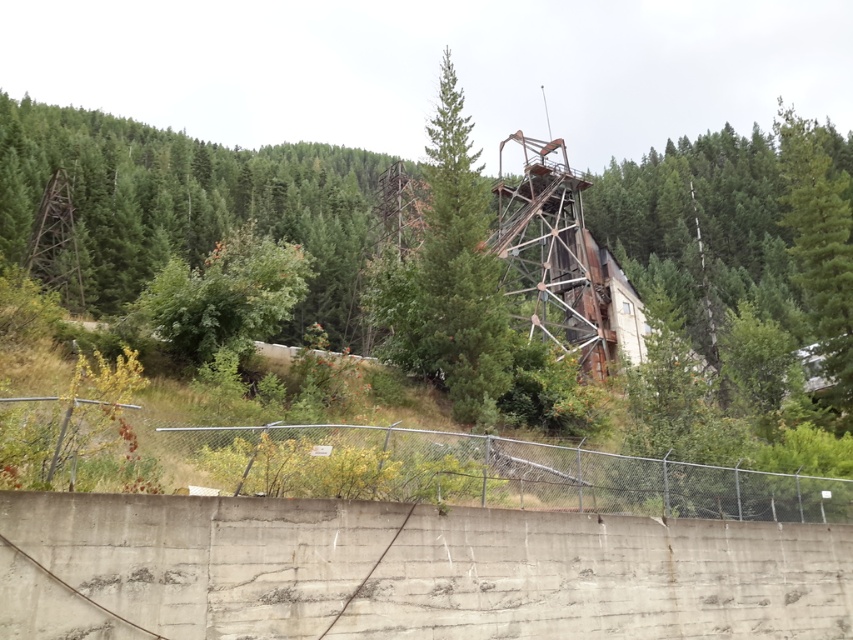
This screenshot has height=640, width=853. Describe the element at coordinates (450, 273) in the screenshot. I see `green matte tree at center` at that location.

Who is more distant from viewer, (466, 234) or (810, 236)?

The point (810, 236) is behind.

The image size is (853, 640). What are the coordinates of `green matte tree at center` in the screenshot? It's located at (450, 273).

Where is `green matte tree at center`? This screenshot has height=640, width=853. green matte tree at center is located at coordinates (450, 273).

Does rusty metal structure at center appear on the right side of metal chain-link fence at center?

Incorrect, rusty metal structure at center is not on the right side of metal chain-link fence at center.

The image size is (853, 640). What do you see at coordinates (187, 204) in the screenshot?
I see `rusty metal structure at center` at bounding box center [187, 204].

Who is more distant from viewer, (107, 257) or (506, 456)?

Positioned behind is point (107, 257).

You are a GUI agent. You are given a task and a screenshot of the screen. Output one action in this format:
    pyautogui.click(x=<x>, y=<y>)
    Task: Click on the rusty metal structure at center
    The width and height of the screenshot is (853, 640).
    Given the screenshot: What is the action you would take?
    pyautogui.click(x=187, y=204)

Is rusty metal structure at center bigger than green matte tree at upper right?

No.

Between point (778, 237) and point (828, 328), which one is positioned behind?

The point (778, 237) is behind.

Is point (676, 291) closer to viewer compared to point (798, 269)?

That is True.

This screenshot has height=640, width=853. I want to click on rusty metal structure at center, so click(187, 204).